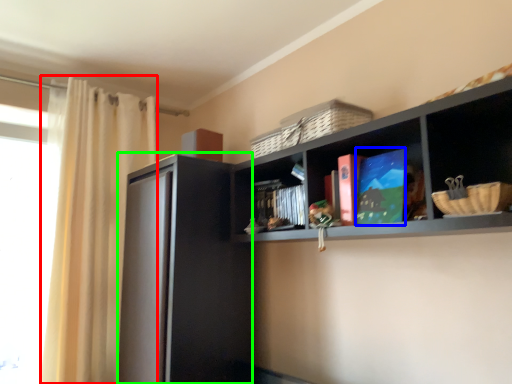
Question: Considering the real-world distances, which object is farthest from curtain (highlighted by a red box)? book (highlighted by a blue box) or screen door (highlighted by a green box)?

Choices:
 (A) book
 (B) screen door

Answer: (A)